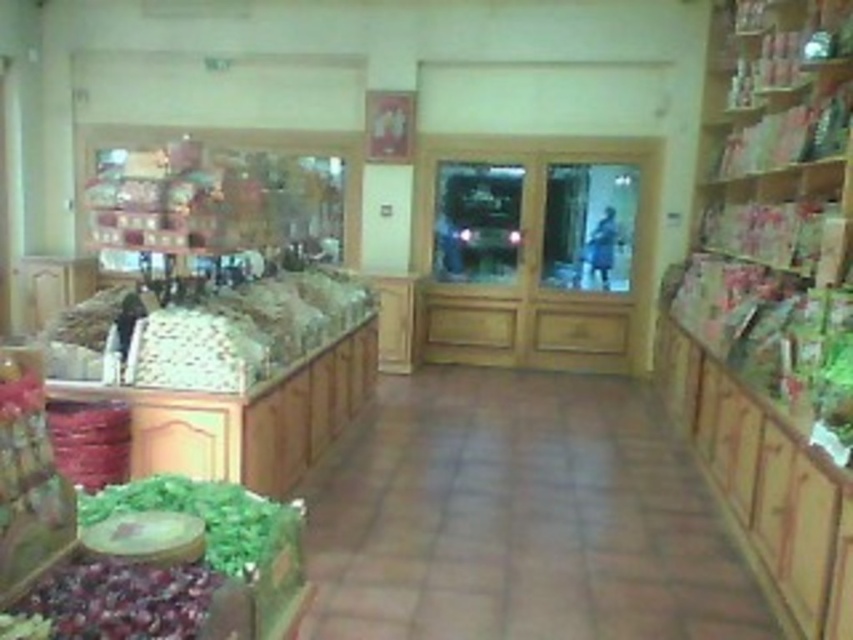
Question: Is green textured herbs at center further to camera compared to green leafy vegetable at lower left?

Choices:
 (A) yes
 (B) no

Answer: (A)

Question: Which is farther from the shiny purple grapes at lower left?

Choices:
 (A) green leafy vegetable at lower left
 (B) green textured herbs at center

Answer: (B)

Question: Does shiny purple grapes at lower left have a larger size compared to green leafy vegetable at lower left?

Choices:
 (A) no
 (B) yes

Answer: (A)

Question: Which object is positioned closest to the green textured herbs at center?

Choices:
 (A) green leafy vegetables at lower left
 (B) green leafy vegetable at lower left

Answer: (A)

Question: Does green textured herbs at center appear over shiny purple grapes at lower left?

Choices:
 (A) yes
 (B) no

Answer: (A)

Question: Which point appears farthest from the camera in this image?

Choices:
 (A) (x=119, y=605)
 (B) (x=258, y=532)
 (C) (x=138, y=630)
 (D) (x=213, y=305)

Answer: (D)